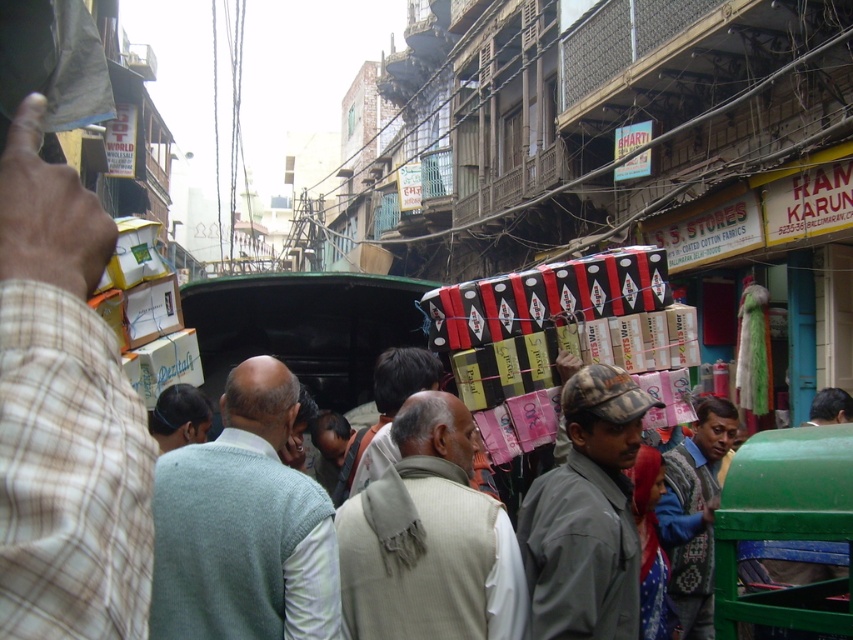
What is the 2D coordinate of the light gray sweater at center?

The light gray sweater at center is located at the 2D coordinate point of (x=242, y=525).